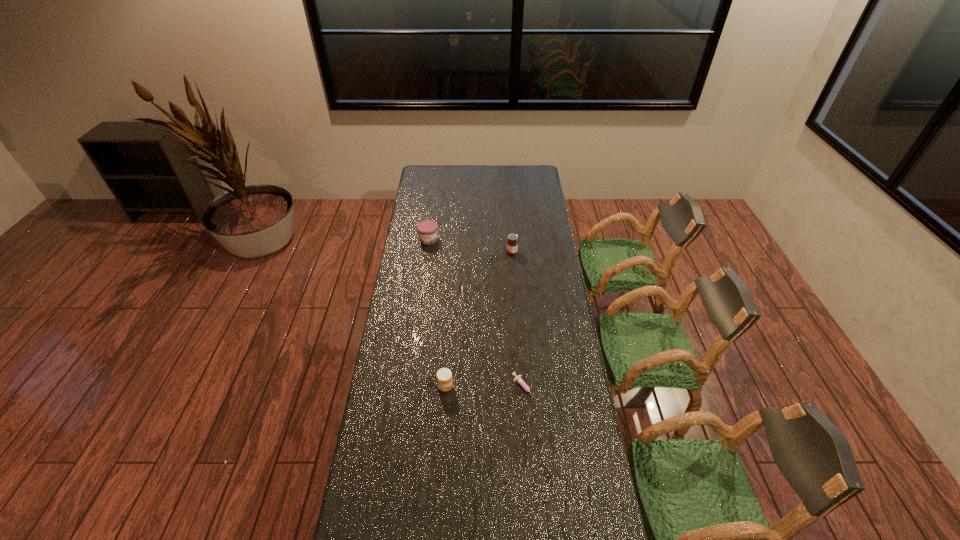
Find the location of a particular element. This screenshot has height=540, width=960. the closest object to the rightmost jam is located at coordinates (427, 230).

Locate which jam is the closest to the farthest object. Please provide its 2D coordinates. Your answer should be formatted as a tuple, i.e. [(x, y)], where the tuple contains the x and y coordinates of a point satisfying the conditions above.

[(512, 244)]

Choose which jam is the second nearest neighbor to the second jam from left to right. Please provide its 2D coordinates. Your answer should be formatted as a tuple, i.e. [(x, y)], where the tuple contains the x and y coordinates of a point satisfying the conditions above.

[(427, 230)]

Image resolution: width=960 pixels, height=540 pixels. I want to click on free space that satisfies the following two spatial constraints: 1. on the front label of the shortest object; 2. on the right side of the farthest jam, so click(x=409, y=388).

Find the location of a particular element. This screenshot has height=540, width=960. vacant space that satisfies the following two spatial constraints: 1. on the label side of the second nearest jam; 2. on the back side of the syringe is located at coordinates (522, 388).

Where is `free space that satisfies the following two spatial constraints: 1. on the label side of the second nearest jam; 2. on the left side of the syringe`? The image size is (960, 540). free space that satisfies the following two spatial constraints: 1. on the label side of the second nearest jam; 2. on the left side of the syringe is located at coordinates (522, 388).

Where is `vacant space that satisfies the following two spatial constraints: 1. on the front label of the shortest object; 2. on the right side of the farthest jam`? Image resolution: width=960 pixels, height=540 pixels. vacant space that satisfies the following two spatial constraints: 1. on the front label of the shortest object; 2. on the right side of the farthest jam is located at coordinates (409, 388).

The width and height of the screenshot is (960, 540). I want to click on free space that satisfies the following two spatial constraints: 1. on the front label of the syringe; 2. on the left side of the leftmost object, so click(409, 388).

This screenshot has width=960, height=540. I want to click on vacant space that satisfies the following two spatial constraints: 1. on the label side of the third nearest object; 2. on the back side of the syringe, so click(x=522, y=388).